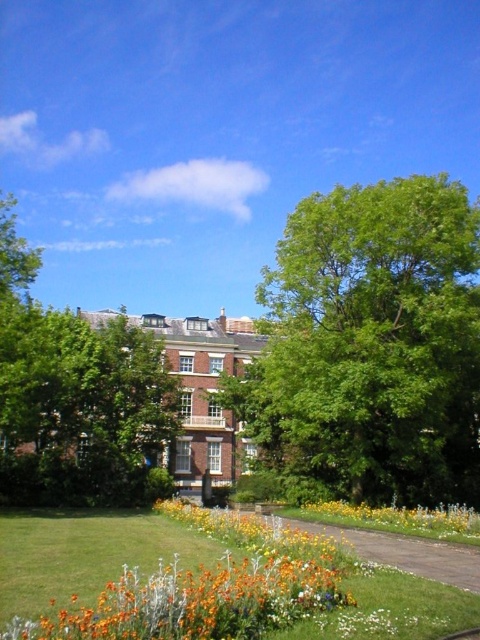
Which is behind, point (134, 426) or point (354, 515)?

The point (134, 426) is more distant.

Is point (48, 323) farther from camera compared to point (333, 512)?

Yes, it is.

Where is `green leafy tree at upper center`? This screenshot has width=480, height=640. green leafy tree at upper center is located at coordinates (75, 396).

Is green leafy tree at center to the right of green leafy tree at upper center from the viewer's perspective?

Yes, green leafy tree at center is to the right of green leafy tree at upper center.

Is point (423, 440) farther from camera compared to point (29, 397)?

No, (423, 440) is in front of (29, 397).

Find the location of a particular element. The height and width of the screenshot is (640, 480). green leafy tree at center is located at coordinates tap(372, 346).

How much distance is there between green leafy tree at center and yellow matte flower at lower center?

A distance of 10.74 meters exists between green leafy tree at center and yellow matte flower at lower center.

Which is more to the right, green leafy tree at center or yellow matte flower at lower center?

yellow matte flower at lower center is more to the right.

The image size is (480, 640). Find the location of `green leafy tree at center`. green leafy tree at center is located at coordinates (372, 346).